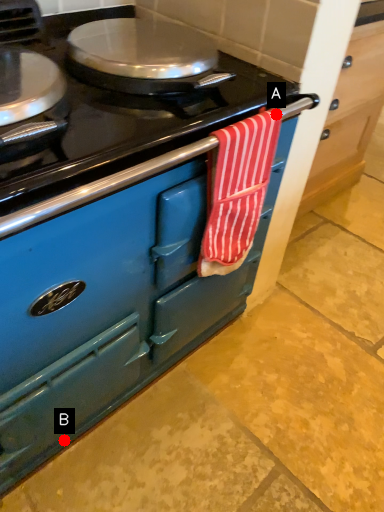
Question: Two points are circled on the image, labeled by A and B beside each circle. Which point appears farthest from the camera in this image?

Choices:
 (A) A is further
 (B) B is further

Answer: (B)